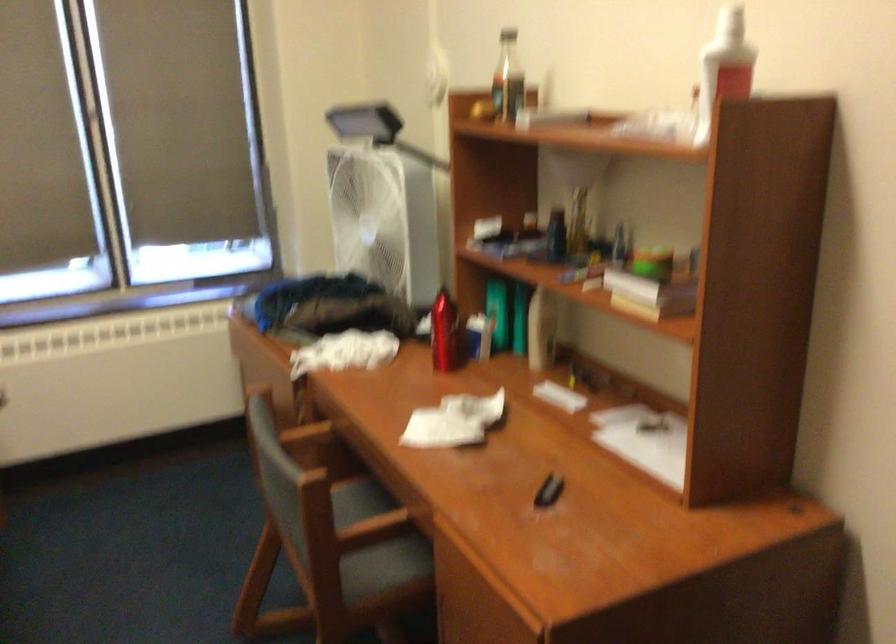
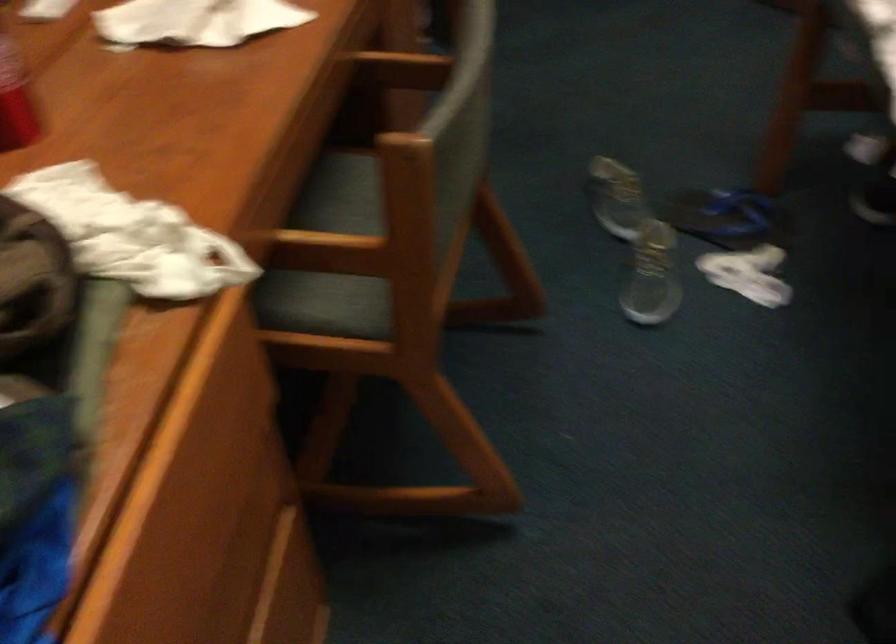
Question: I am providing you with two images of the same scene from different viewpoints. Which of the following objects are not visible in image2?

Choices:
 (A) chair sitting surface
 (B) gray cushion
 (C) gray sneaker
 (D) chair armrest

Answer: (D)